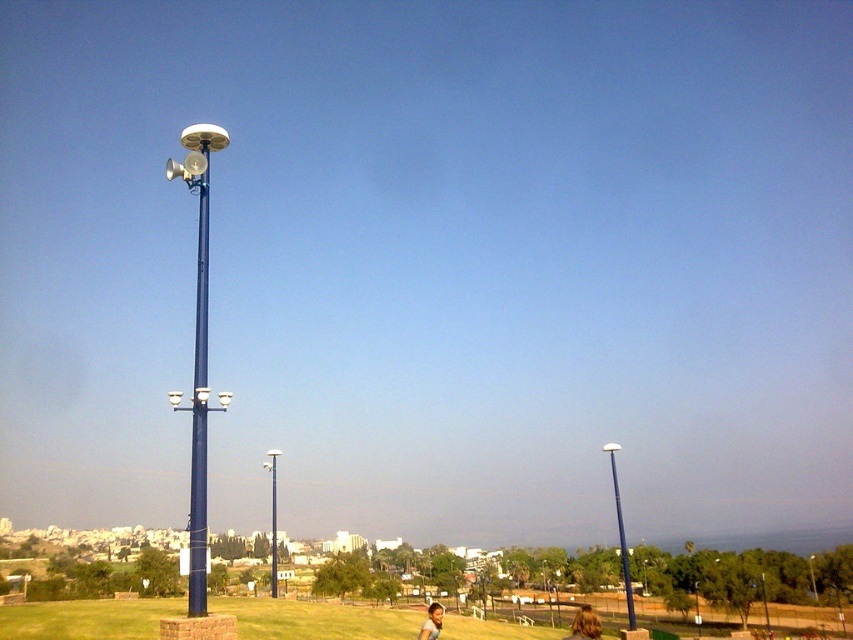
Is metallic blue pole at left in front of blue metallic pole at center?

No, it is not.

Locate an element on the screen. metallic blue pole at left is located at coordinates (198, 355).

This screenshot has height=640, width=853. I want to click on metallic blue pole at left, so click(198, 355).

Does smooth skin face at lower center come behind metallic pole at center?

No, it is in front of metallic pole at center.

Does point (427, 618) come closer to viewer compared to point (764, 611)?

Yes.

The image size is (853, 640). I want to click on smooth skin face at lower center, so pyautogui.click(x=431, y=621).

Can you confirm if smooth skin face at lower center is positioned above metallic silver pole at right?

Yes.

At what (x,y) coordinates should I click in order to perform the action: click on smooth skin face at lower center. Please return your answer as a coordinate pair (x, y). This screenshot has width=853, height=640. Looking at the image, I should click on (431, 621).